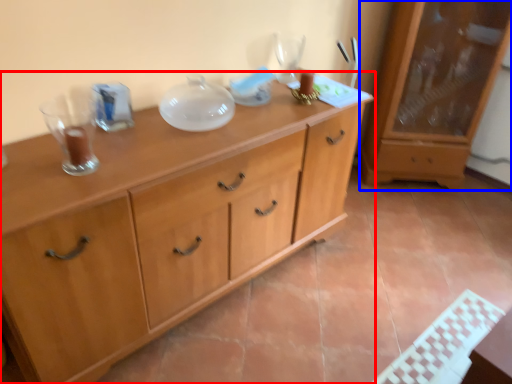
Question: Which object is closer to the camera taking this photo, chest of drawers (highlighted by a red box) or cabinetry (highlighted by a blue box)?

Choices:
 (A) chest of drawers
 (B) cabinetry

Answer: (A)